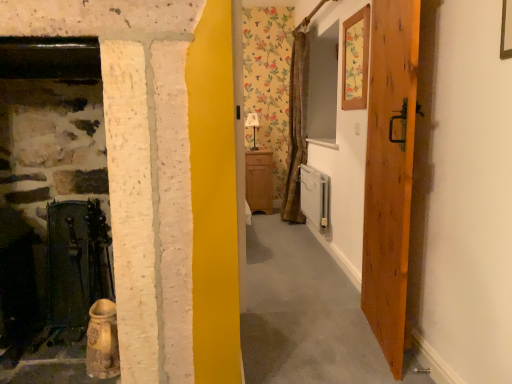
Locate an element on the screen. free spot to the left of wooden door at right is located at coordinates (304, 339).